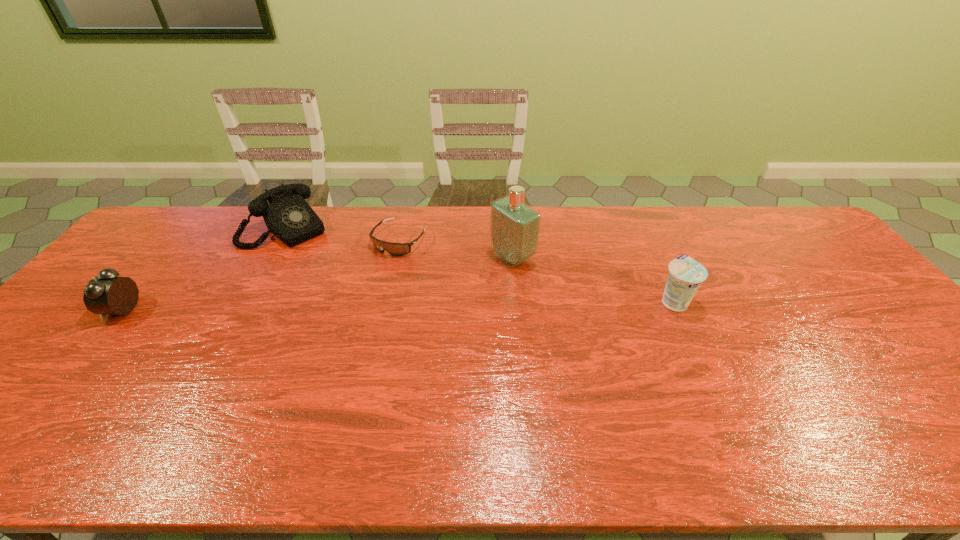
Where is `object that is at the left edge`? object that is at the left edge is located at coordinates (106, 294).

Find the location of a particular element. The height and width of the screenshot is (540, 960). vacant space at the far edge of the desktop is located at coordinates 341,209.

Locate an element on the screen. The image size is (960, 540). free space at the near edge of the desktop is located at coordinates (508, 410).

I want to click on free spot at the right edge of the desktop, so click(825, 307).

Find the location of a particular element. vacant space that's between the leftmost object and the third object from left to right is located at coordinates (261, 275).

Find the location of a particular element. The height and width of the screenshot is (540, 960). free space between the alarm clock and the tallest object is located at coordinates (318, 284).

Identify the location of vacant point located between the alarm clock and the tallest object. (318, 284).

Identify the location of vacant point located between the rightmost object and the second object from left to right. The width and height of the screenshot is (960, 540). (480, 265).

Where is `vacant region between the perfume and the third object from left to right`? This screenshot has width=960, height=540. vacant region between the perfume and the third object from left to right is located at coordinates (456, 248).

At what (x,y) coordinates should I click in order to perform the action: click on vacant area that lies between the third object from right to left and the second object from right to left. Please return your answer as a coordinate pair (x, y). Looking at the image, I should click on (456, 248).